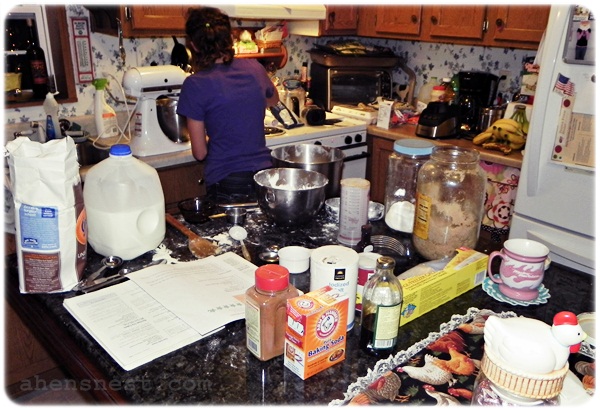
This screenshot has width=600, height=410. Find the location of `bowl`. bowl is located at coordinates (296, 211).